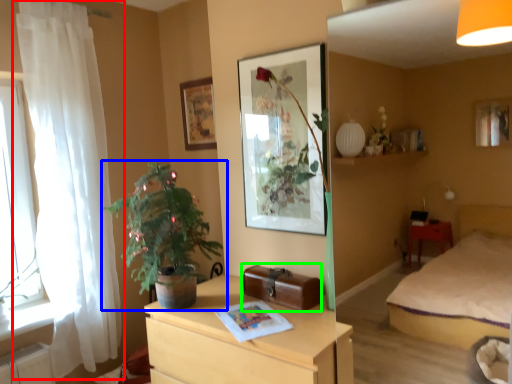
Question: Estimate the real-world distances between objects in this image. Which object is closer to curtain (highlighted by a red box), houseplant (highlighted by a blue box) or luggage (highlighted by a green box)?

Choices:
 (A) houseplant
 (B) luggage

Answer: (A)